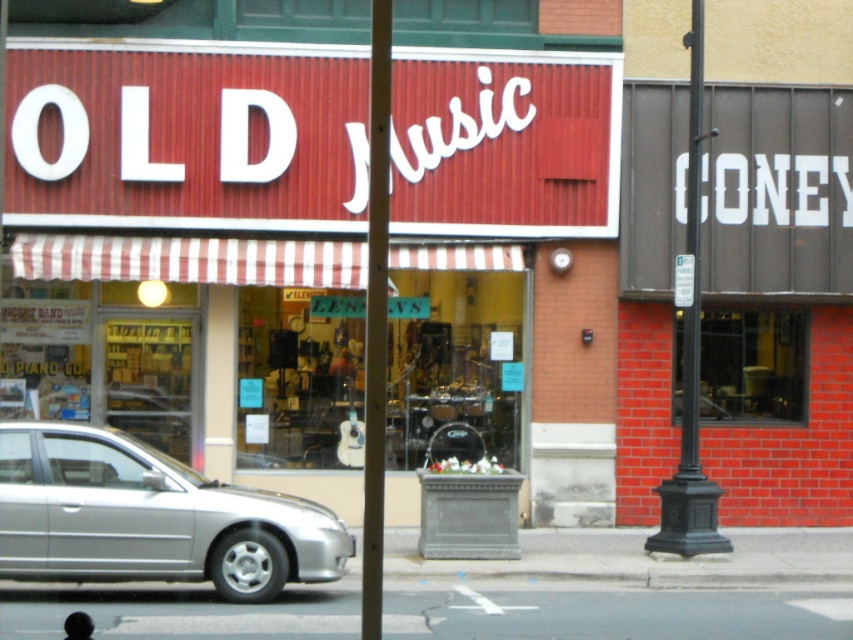
Does silver metallic car at lower left have a lesser width compared to black metal pole at right?

No, silver metallic car at lower left is not thinner than black metal pole at right.

Is silver metallic car at lower left to the right of black metal pole at right from the viewer's perspective?

In fact, silver metallic car at lower left is to the left of black metal pole at right.

Does point (170, 509) lie in front of point (683, 387)?

Yes.

The height and width of the screenshot is (640, 853). I want to click on silver metallic car at lower left, so click(x=149, y=516).

Does smooth wooden pole at center appear on the left side of black metal pole at right?

Indeed, smooth wooden pole at center is positioned on the left side of black metal pole at right.

Is the position of smooth wooden pole at center less distant than that of black metal pole at right?

That is True.

At what (x,y) coordinates should I click in order to perform the action: click on smooth wooden pole at center. Please return your answer as a coordinate pair (x, y). Looking at the image, I should click on (376, 320).

Is silver metallic car at lower left positioned at the back of smooth wooden pole at center?

Yes, it is.

Is silver metallic car at lower left smaller than smooth wooden pole at center?

Yes, silver metallic car at lower left is smaller than smooth wooden pole at center.

Image resolution: width=853 pixels, height=640 pixels. I want to click on silver metallic car at lower left, so click(x=149, y=516).

I want to click on silver metallic car at lower left, so click(x=149, y=516).